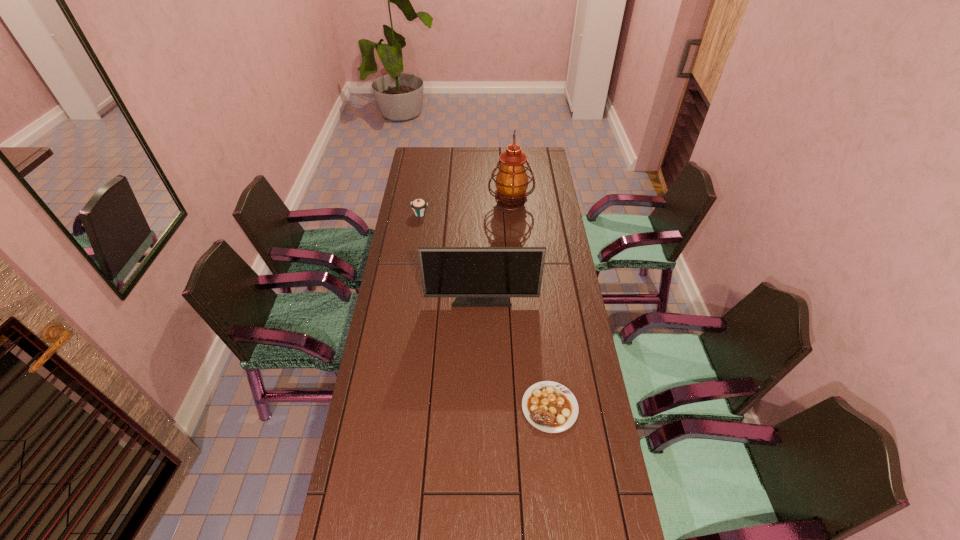
In order to click on object that is the nearest to the tallest object in this screenshot , I will do `click(419, 206)`.

I want to click on the third closest object to the nearest object, so click(419, 206).

The height and width of the screenshot is (540, 960). I want to click on free space that satisfies the following two spatial constraints: 1. on the back side of the second shortest object; 2. on the right side of the oil lamp, so click(421, 205).